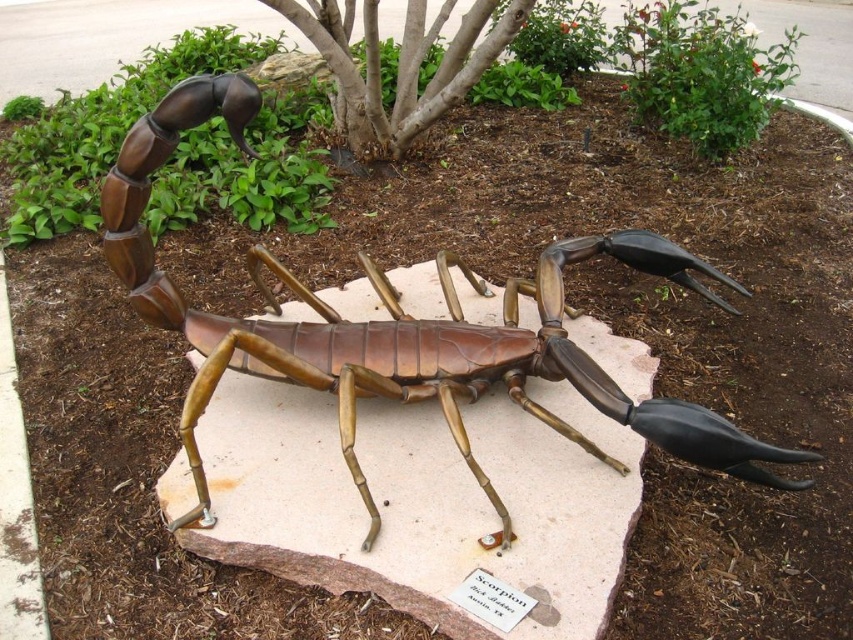
You are standing in front of the bronze metallic scorpion at center and the brown bark tree at center. Which object is closer to you?

The bronze metallic scorpion at center is closer to you because it is in front of the brown bark tree at center.

You are standing in front of a large metallic scorpion sculpture. The sculpture is mounted on a stone base surrounded by mulch and green shrubs. There is a point labeled as point (405, 328) in the image. Which object corresponds to this point?

The bronze metallic scorpion at center corresponds to point (405, 328).

You are standing at the center of the sculpture garden and want to locate the bronze metallic scorpion at center. According to the coordinates provided, what are the exact coordinates where you should look to find it?

The bronze metallic scorpion at center is located at coordinates point (405, 328).